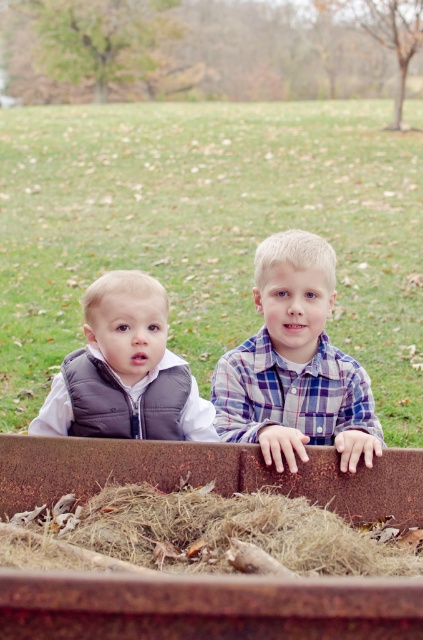
Who is higher up, brown dry hay at center or blue plaid shirt at center?

blue plaid shirt at center is higher up.

Between brown dry hay at center and blue plaid shirt at center, which one appears on the left side from the viewer's perspective?

brown dry hay at center

Where is `brown dry hay at center`? The height and width of the screenshot is (640, 423). brown dry hay at center is located at coordinates (209, 532).

At what (x,y) coordinates should I click in order to perform the action: click on brown dry hay at center. Please return your answer as a coordinate pair (x, y). This screenshot has height=640, width=423. Looking at the image, I should click on (209, 532).

Does blue plaid shirt at center have a smaller size compared to matte gray vest at left?

No.

The height and width of the screenshot is (640, 423). What do you see at coordinates (294, 364) in the screenshot?
I see `blue plaid shirt at center` at bounding box center [294, 364].

You are a GUI agent. You are given a task and a screenshot of the screen. Output one action in this format:
    pyautogui.click(x=<x>, y=<y>)
    Task: Click on the blue plaid shirt at center
    
    Given the screenshot: What is the action you would take?
    pyautogui.click(x=294, y=364)

I want to click on blue plaid shirt at center, so click(x=294, y=364).

Is brown dry hay at center further to camera compared to matte gray vest at left?

No, brown dry hay at center is in front of matte gray vest at left.

Is brown dry hay at center to the left of matte gray vest at left from the viewer's perspective?

No, brown dry hay at center is not to the left of matte gray vest at left.

Who is more forward, [186,484] or [145,300]?

Point [145,300] is in front.

Image resolution: width=423 pixels, height=640 pixels. Find the location of `brown dry hay at center`. brown dry hay at center is located at coordinates (209, 532).